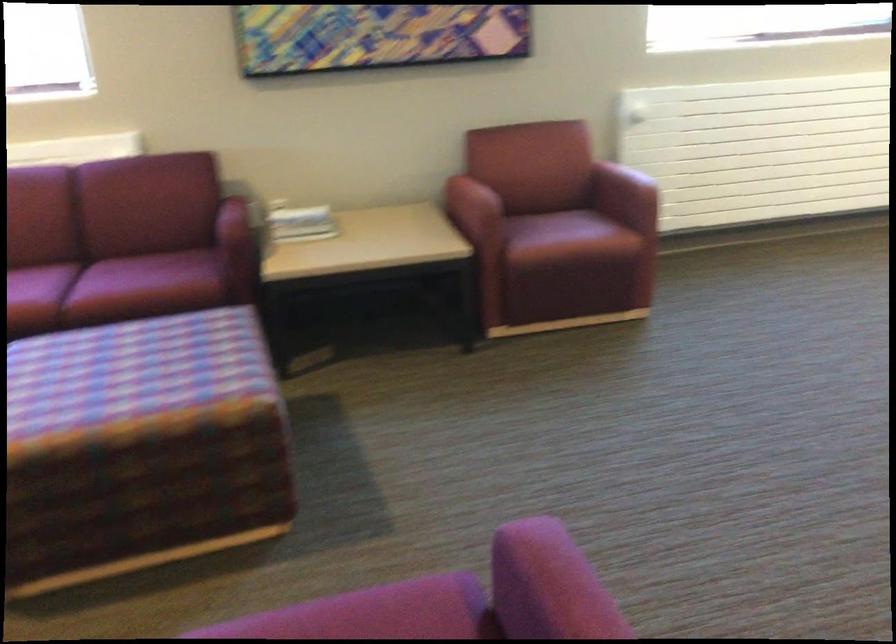
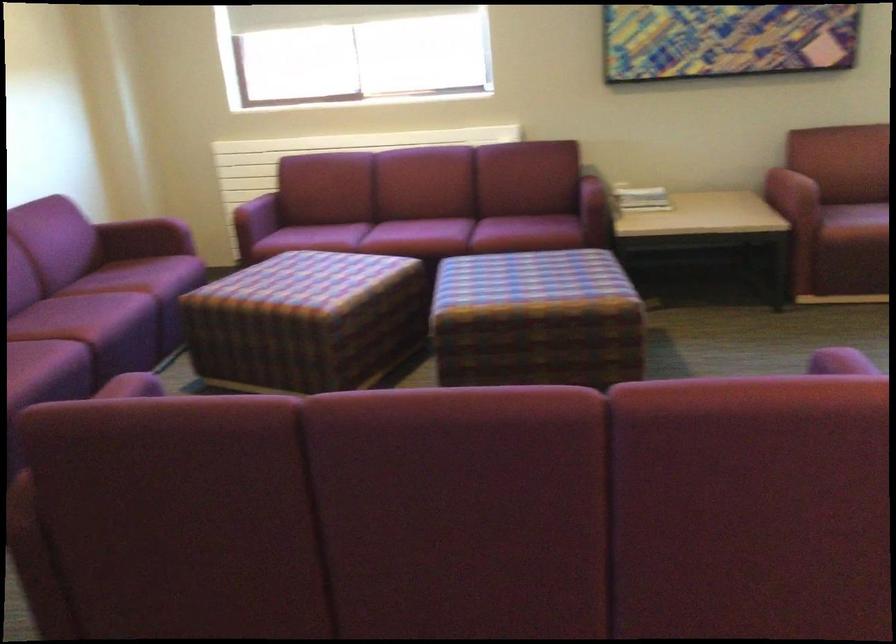
In the second image, find the point that corresponds to point (470, 216) in the first image.

(791, 194)